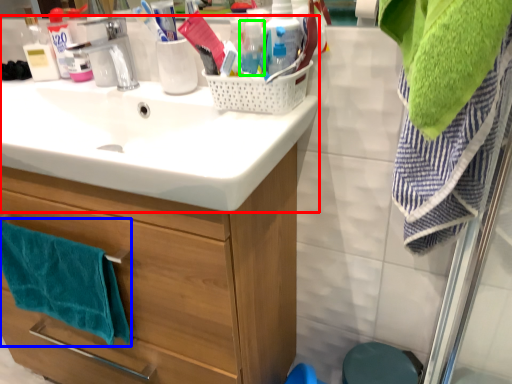
Question: Estimate the real-world distances between objects in this image. Which object is closer to sink (highlighted by a red box), bath towel (highlighted by a blue box) or bottle (highlighted by a green box)?

Choices:
 (A) bath towel
 (B) bottle

Answer: (A)